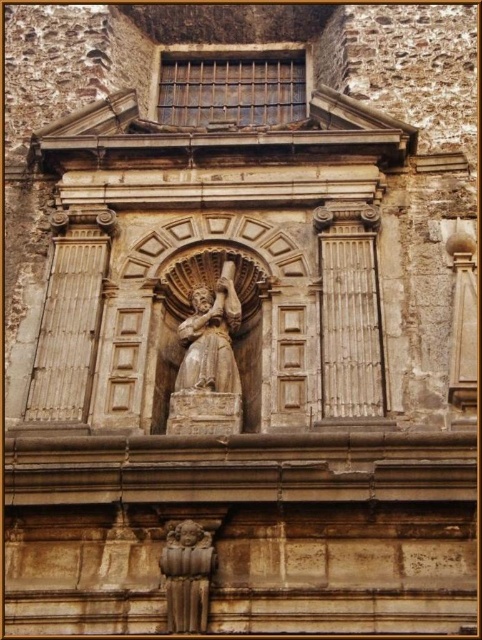
You are an architect analyzing the building facade. You notice the rusty metal window at upper center and the brown stone cherub at lower center. Which object is taller?

The rusty metal window at upper center is taller than the brown stone cherub at lower center.

In the scene shown: You are an art conservator assessing the structure for preservation. You notice the rusty metal window at upper center and the brown stone cherub at lower center. Which object is located higher up on the building?

The rusty metal window at upper center is positioned over the brown stone cherub at lower center, so it is higher up on the building.

You are an architect examining the old stone building. You notice two points marked on the facade. The first point is at coordinates point (236,49) and the second is at point (178,579). From your vantage point, which point is closer to you?

Point (178,579) is closer to you because the description states that point (236,49) is behind point (178,579).